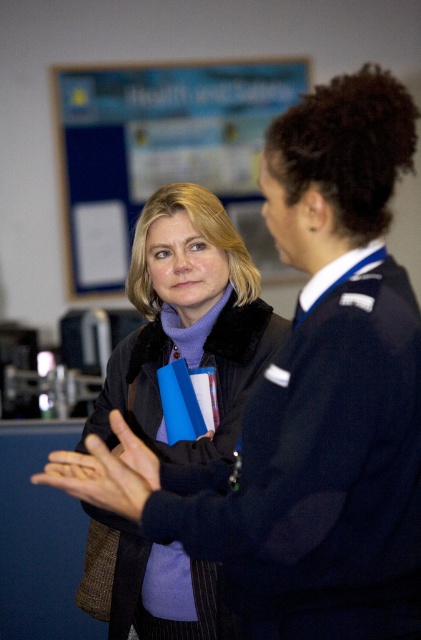
Is point (175, 129) behind point (112, 484)?

Yes, point (175, 129) is behind point (112, 484).

In the scene shown: Does blue paperboard at upper center appear on the left side of matte black hand at center?

Incorrect, blue paperboard at upper center is not on the left side of matte black hand at center.

Between point (199, 120) and point (103, 470), which one is positioned behind?

Point (199, 120)

Where is `blue paperboard at upper center`? blue paperboard at upper center is located at coordinates (162, 152).

Who is positioned more to the right, matte black jacket at center or matte black hand at center?

Positioned to the right is matte black jacket at center.

Does matte black jacket at center have a smaller size compared to matte black hand at center?

No.

What do you see at coordinates (189, 321) in the screenshot? I see `matte black jacket at center` at bounding box center [189, 321].

Find the location of a particular element. matte black jacket at center is located at coordinates (189, 321).

Between matte black jacket at center and blue paperboard at upper center, which one has more height?

blue paperboard at upper center is taller.

This screenshot has width=421, height=640. What do you see at coordinates (189, 321) in the screenshot?
I see `matte black jacket at center` at bounding box center [189, 321].

In order to click on matte black jacket at center in this screenshot , I will do `click(189, 321)`.